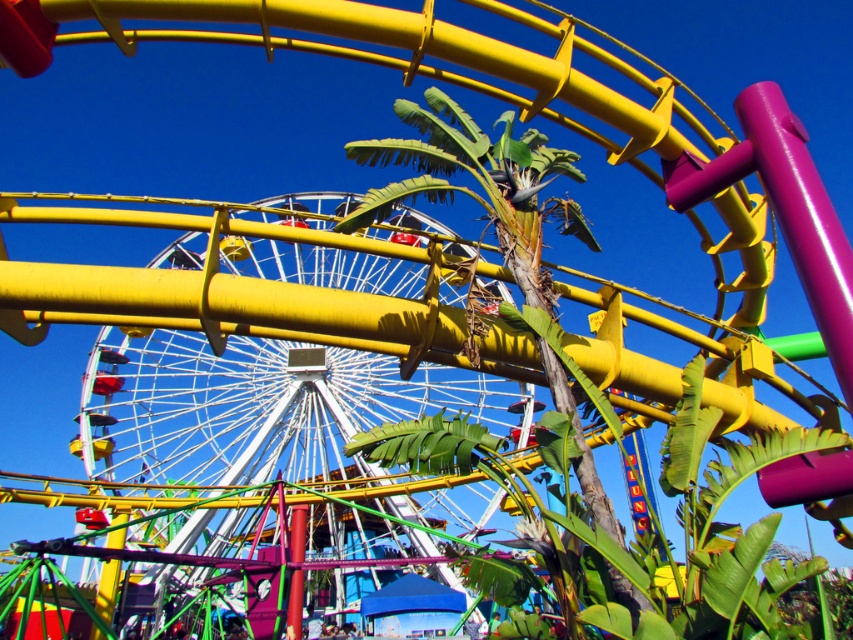
You are standing at the entrance of the amusement park and want to locate the metallic white ferris wheel at center. According to the coordinates provided, where should you look relative to your current position?

The metallic white ferris wheel at center is located at coordinates point (285, 428), which means it is positioned to the right and slightly above your current position.

You are standing at the point with coordinates point (160, 381) and want to walk to the point with coordinates point (616, 582). According to the scene, is there any obstruction between your current position and your destination?

Point (160, 381) is behind point (616, 582), so there is an obstruction between them.